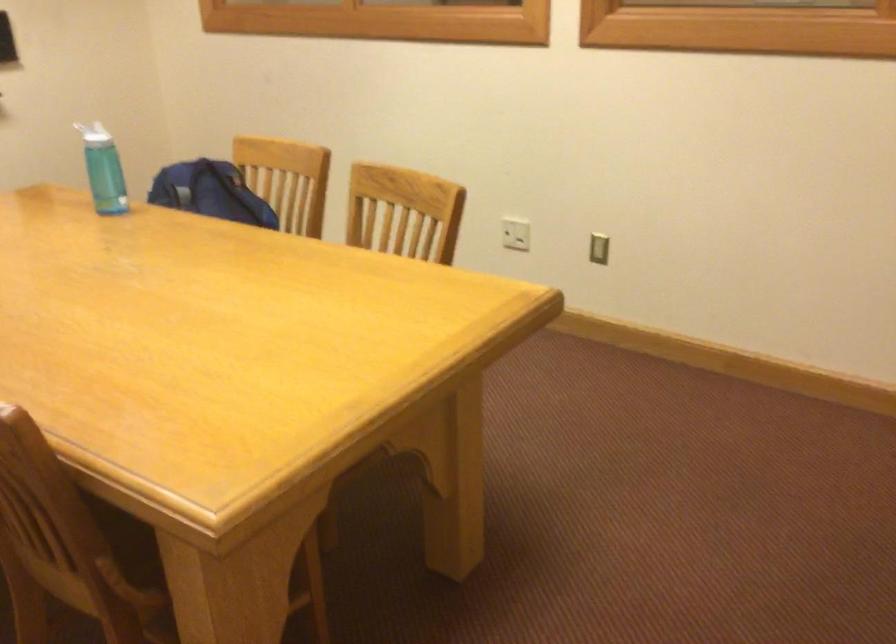
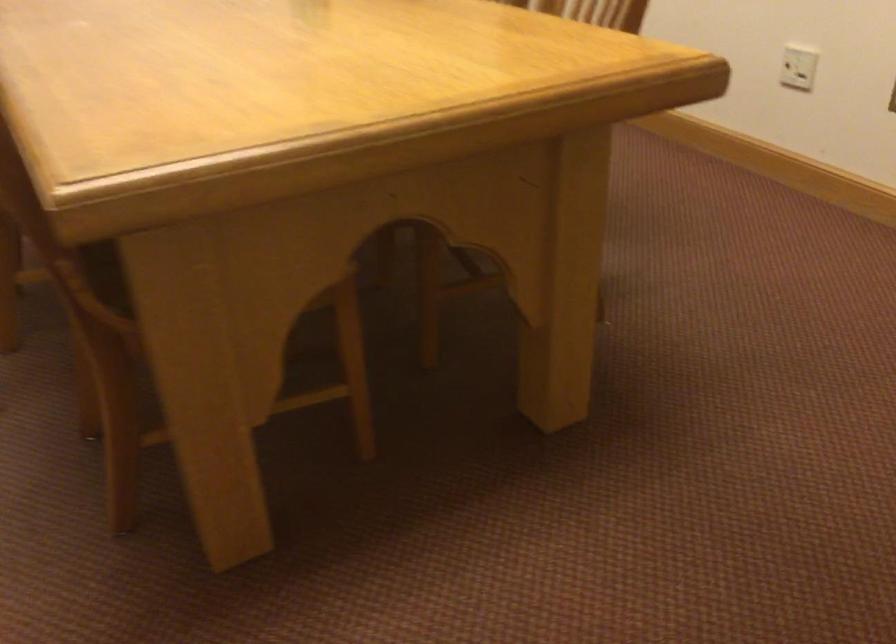
Question: The camera is either moving clockwise (left) or counter-clockwise (right) around the object. The first image is from the beginning of the video and the second image is from the end. Is the camera moving left or right when shooting the video?

Choices:
 (A) Left
 (B) Right

Answer: (B)